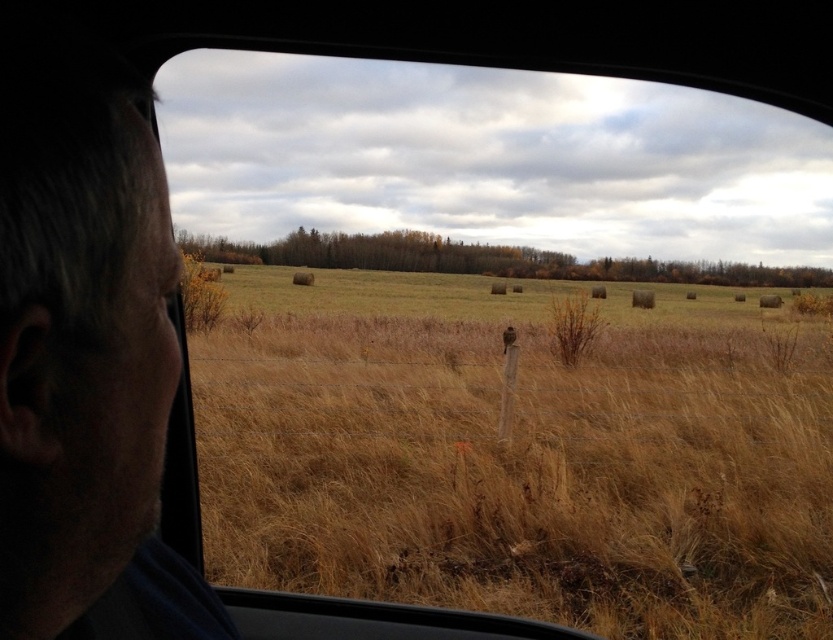
Can you confirm if dry grass at center is bigger than gray hair at left?

Yes, dry grass at center is bigger than gray hair at left.

Is dry grass at center to the left of gray hair at left from the viewer's perspective?

Incorrect, dry grass at center is not on the left side of gray hair at left.

This screenshot has width=833, height=640. I want to click on dry grass at center, so click(x=519, y=454).

Find the location of `dry grass at center`. dry grass at center is located at coordinates (519, 454).